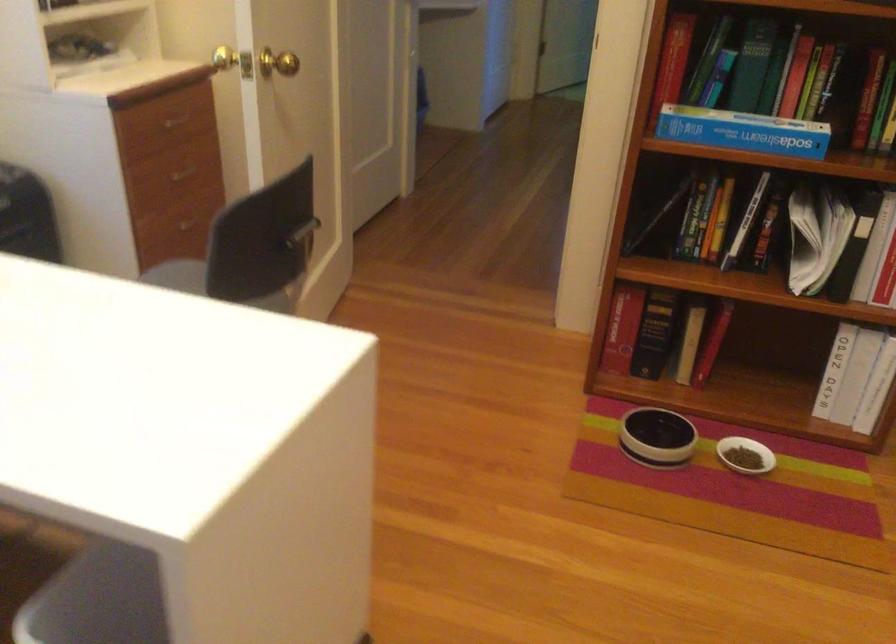
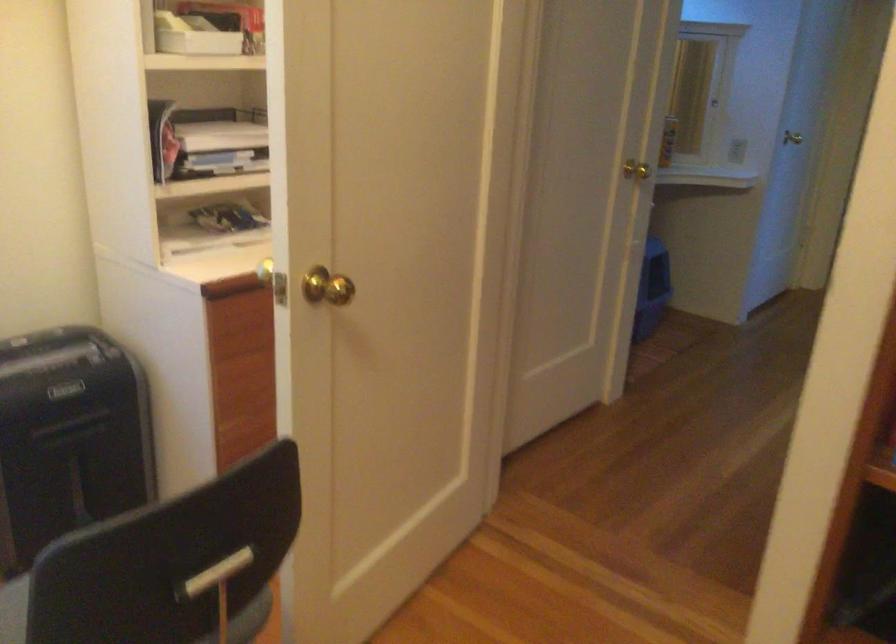
Question: The camera is either moving clockwise (left) or counter-clockwise (right) around the object. The first image is from the beginning of the video and the second image is from the end. Is the camera moving left or right when shooting the video?

Choices:
 (A) Left
 (B) Right

Answer: (B)